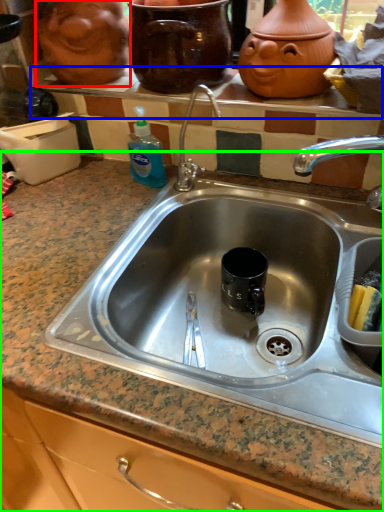
Question: Estimate the real-world distances between objects in this image. Which object is closer to face (highlighted by a red box), window sill (highlighted by a blue box) or countertop (highlighted by a green box)?

Choices:
 (A) window sill
 (B) countertop

Answer: (A)